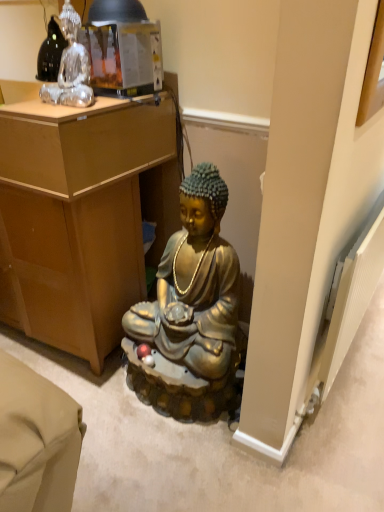
The image size is (384, 512). I want to click on space that is in front of silver metallic statue at upper left, so click(52, 118).